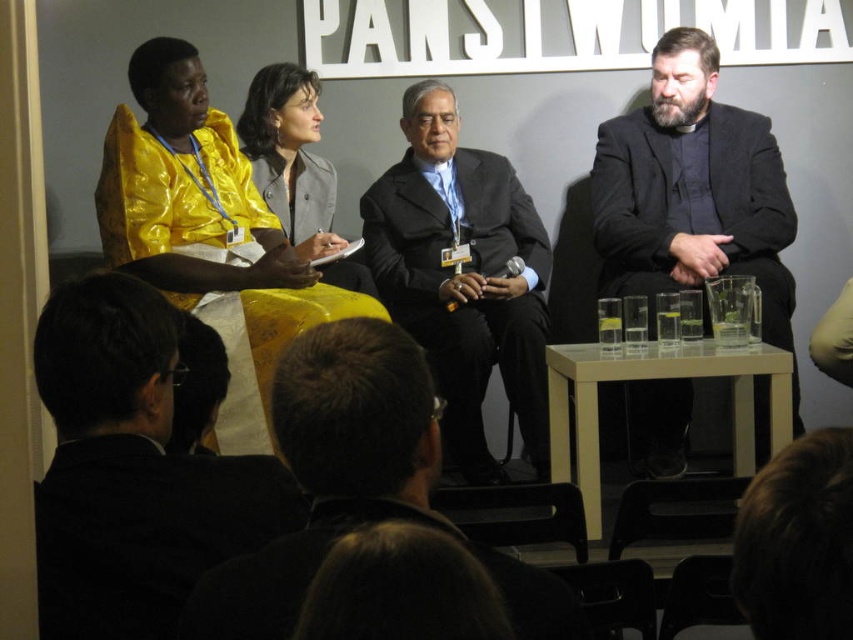
What is the location of the point with coordinates (320, 563) in the image?

The point with coordinates (320, 563) is located on the black matte suit at lower center.

Based on the coordinates provided in the scene description, where is the dark brown hair at center located?

The dark brown hair at center is located at the coordinates point (357, 484).

You are sitting in the audience and want to see both the black matte suit at lower center and the black smooth suit at center clearly. Which one is closer to you?

The black matte suit at lower center is closer to you since it is in front of the black smooth suit at center.